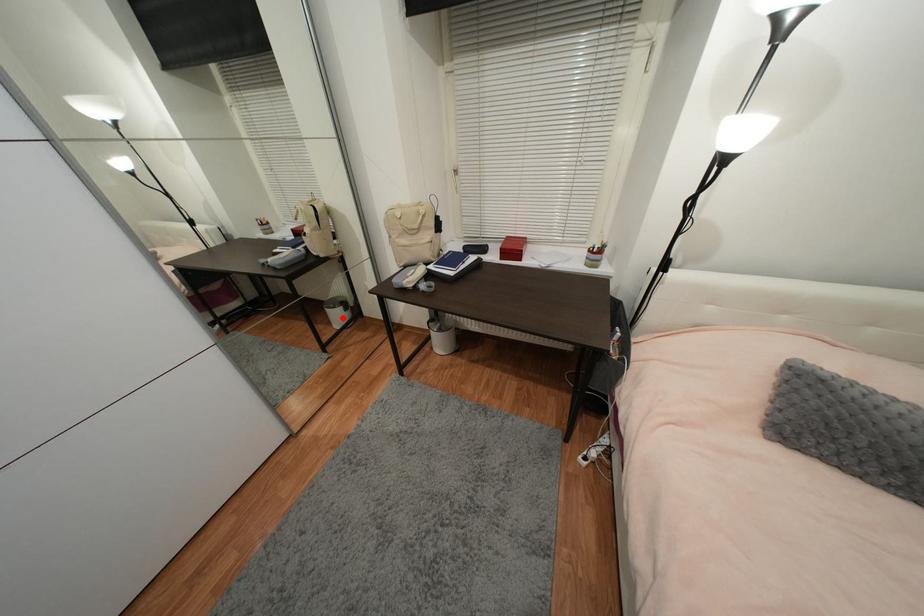
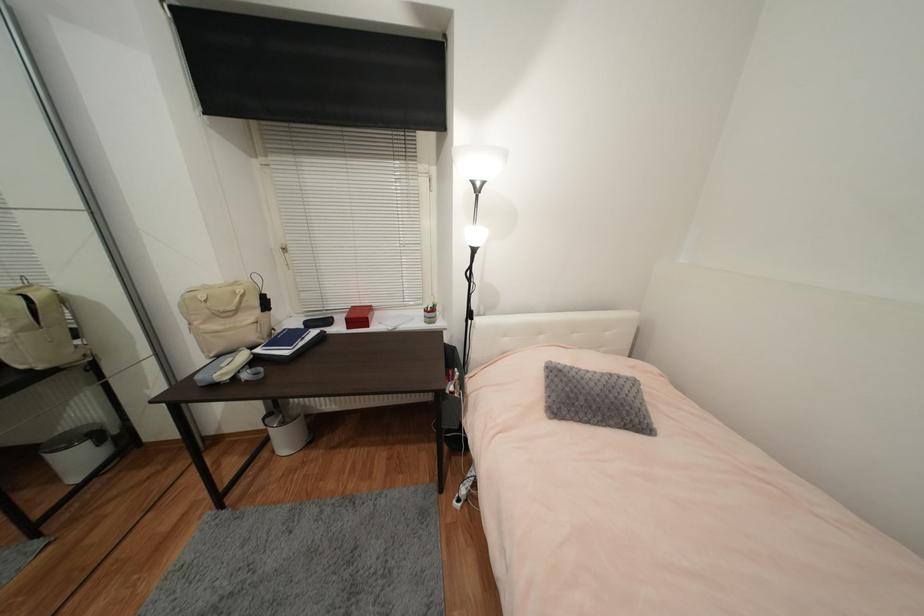
The point at the highlighted location is marked in the first image. Where is the corresponding point in the second image?

(83, 462)